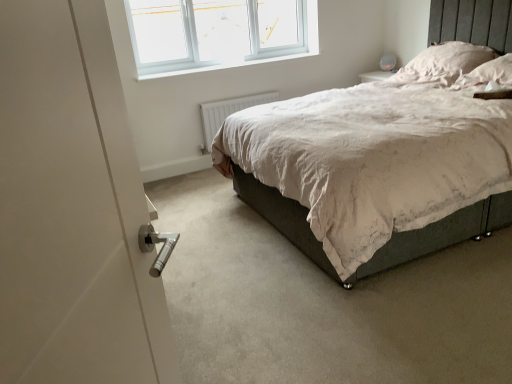
Question: Does white soft pillow at upper right, the second pillow when ordered from back to front, have a lesser height compared to white smooth window sill at upper center?

Choices:
 (A) no
 (B) yes

Answer: (A)

Question: From the image's perspective, does white soft pillow at upper right, the second pillow when ordered from back to front, appear higher than white smooth window sill at upper center?

Choices:
 (A) no
 (B) yes

Answer: (A)

Question: Is the position of white soft pillow at upper right, the second pillow when ordered from back to front, more distant than that of white smooth window sill at upper center?

Choices:
 (A) no
 (B) yes

Answer: (A)

Question: From a real-world perspective, does white soft pillow at upper right, the second pillow when ordered from back to front, sit lower than white smooth window sill at upper center?

Choices:
 (A) yes
 (B) no

Answer: (A)

Question: Considering the relative sizes of white soft pillow at upper right, the second pillow when ordered from back to front, and white smooth window sill at upper center in the image provided, is white soft pillow at upper right, the second pillow when ordered from back to front, taller than white smooth window sill at upper center?

Choices:
 (A) yes
 (B) no

Answer: (A)

Question: Can you confirm if white soft pillow at upper right, the second pillow when ordered from back to front, is bigger than white smooth window sill at upper center?

Choices:
 (A) no
 (B) yes

Answer: (B)

Question: From a real-world perspective, is white plastic window at upper center below white smooth window sill at upper center?

Choices:
 (A) yes
 (B) no

Answer: (B)

Question: Is white plastic window at upper center oriented away from white smooth window sill at upper center?

Choices:
 (A) yes
 (B) no

Answer: (B)

Question: Considering the relative positions of white plastic window at upper center and white smooth window sill at upper center in the image provided, is white plastic window at upper center to the right of white smooth window sill at upper center from the viewer's perspective?

Choices:
 (A) yes
 (B) no

Answer: (B)

Question: Is white plastic window at upper center smaller than white smooth window sill at upper center?

Choices:
 (A) yes
 (B) no

Answer: (B)

Question: Considering the relative positions of white plastic window at upper center and white smooth window sill at upper center in the image provided, is white plastic window at upper center to the left of white smooth window sill at upper center from the viewer's perspective?

Choices:
 (A) yes
 (B) no

Answer: (A)

Question: From the image's perspective, is white plastic window at upper center over white smooth window sill at upper center?

Choices:
 (A) yes
 (B) no

Answer: (A)

Question: Is the depth of white soft pillow at upper right, the 1th pillow when ordered from back to front, less than that of white soft pillow at upper right, placed as the 1th pillow when sorted from front to back?

Choices:
 (A) no
 (B) yes

Answer: (A)